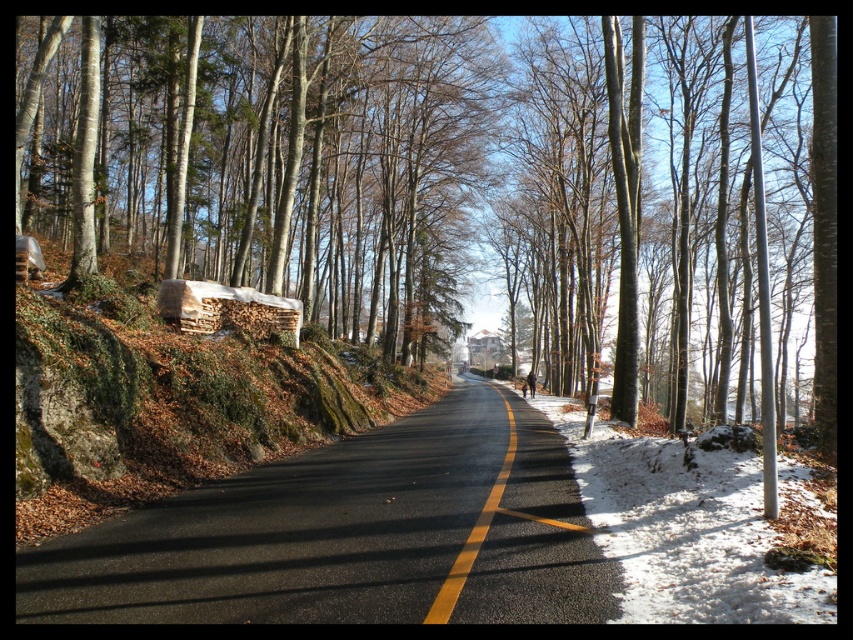
Question: Can you confirm if brown woodpile at center is positioned below brown woodpile at left?

Choices:
 (A) yes
 (B) no

Answer: (B)

Question: Based on their relative distances, which object is farther from the yellow asphalt road at center?

Choices:
 (A) smooth bark tree at left
 (B) brown woodpile at center
 (C) brown woodpile at left

Answer: (B)

Question: Is smooth bark tree at left above brown woodpile at left?

Choices:
 (A) no
 (B) yes

Answer: (B)

Question: Which object is farther from the camera taking this photo?

Choices:
 (A) brown woodpile at left
 (B) yellow asphalt road at center
 (C) brown woodpile at center
 (D) smooth bark tree at left

Answer: (D)

Question: Does brown woodpile at center appear on the right side of brown woodpile at left?

Choices:
 (A) no
 (B) yes

Answer: (B)

Question: Which object appears closest to the camera in this image?

Choices:
 (A) smooth bark tree at left
 (B) yellow asphalt road at center
 (C) brown woodpile at left

Answer: (B)